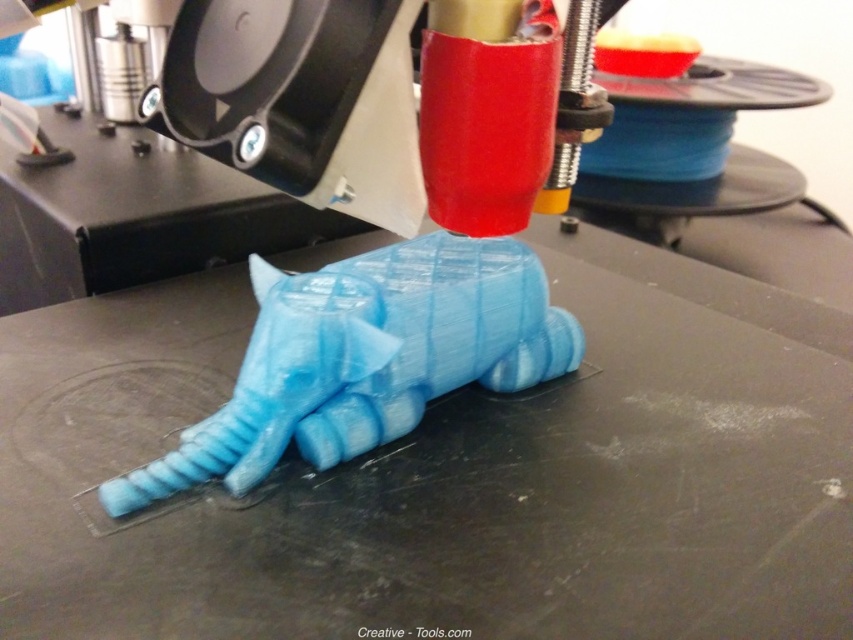
You are a technician inspecting a 3D printer. You notice two points on the printer bed at coordinates point (753, 545) and point (247, 458). Which point is nearer to the camera?

Point (753, 545) is closer to the camera than point (247, 458).